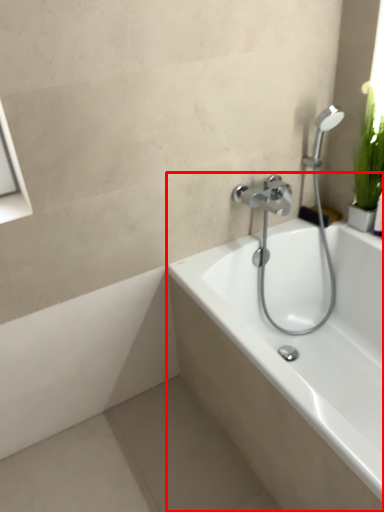
Question: From the image's perspective, what is the correct spatial positioning of bathtub (annotated by the red box) in reference to plumbing fixture?

Choices:
 (A) below
 (B) above

Answer: (A)